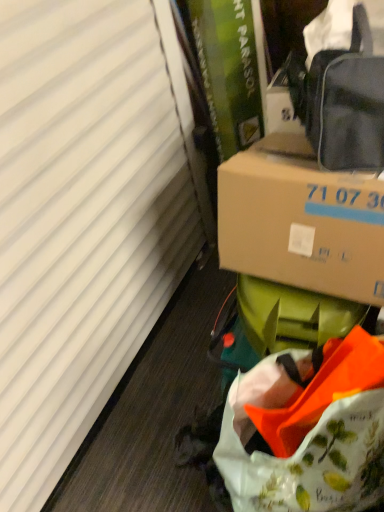
Describe the element at coordinates (342, 101) in the screenshot. Image resolution: width=384 pixels, height=512 pixels. I see `matte black bag at upper right` at that location.

The height and width of the screenshot is (512, 384). What are the coordinates of `white matte curtain at left` in the screenshot? It's located at (82, 220).

The width and height of the screenshot is (384, 512). I want to click on matte black bag at upper right, so click(342, 101).

Considering the positions of point (351, 298) and point (141, 241), is point (351, 298) closer or farther from the camera than point (141, 241)?

Point (351, 298) is closer to the camera than point (141, 241).

How different are the orientations of brown cardboard box at center-right and white matte curtain at left in degrees?

The facing directions of brown cardboard box at center-right and white matte curtain at left are 90.3 degrees apart.

Are brown cardboard box at center-right and white matte curtain at left located far from each other?

No, there isn't a large distance between brown cardboard box at center-right and white matte curtain at left.

Find the location of a particular element. Image resolution: width=384 pixels, height=512 pixels. box positioned vertically above the floral printed fabric bag at lower right (from a real-world perspective) is located at coordinates (301, 221).

In terms of height, does brown cardboard box at center-right look taller or shorter compared to floral printed fabric bag at lower right?

In the image, brown cardboard box at center-right appears to be shorter than floral printed fabric bag at lower right.

Does point (232, 252) come farther from viewer compared to point (294, 416)?

Yes, it is.

What's the angular difference between matte black bag at upper right and brown cardboard box at center-right's facing directions?

The angle between the facing direction of matte black bag at upper right and the facing direction of brown cardboard box at center-right is 5.55 degrees.

Considering the sizes of matte black bag at upper right and brown cardboard box at center-right in the image, is matte black bag at upper right bigger or smaller than brown cardboard box at center-right?

In the image, matte black bag at upper right appears to be smaller than brown cardboard box at center-right.

Choose the correct answer: Is matte black bag at upper right inside brown cardboard box at center-right or outside it?

matte black bag at upper right is not enclosed by brown cardboard box at center-right.

Which is closer, (376, 92) or (346, 291)?

Clearly, point (376, 92) is closer to the camera than point (346, 291).

Which is in front, point (370, 378) or point (314, 148)?

The point (370, 378) is closer to the camera.

Is floral printed fabric bag at lower right facing away from matte black bag at upper right?

That's not correct — floral printed fabric bag at lower right is not looking away from matte black bag at upper right.

Is the surface of floral printed fabric bag at lower right in direct contact with matte black bag at upper right?

No, floral printed fabric bag at lower right is not with matte black bag at upper right.

Which object is further away from the camera taking this photo, floral printed fabric bag at lower right or matte black bag at upper right?

matte black bag at upper right is behind.

Is point (91, 166) closer or farther from the camera than point (368, 201)?

Clearly, point (91, 166) is more distant from the camera than point (368, 201).

Is white matte curtain at left turned away from brown cardboard box at center-right?

Correct, white matte curtain at left is looking away from brown cardboard box at center-right.

How different are the orientations of white matte curtain at left and brown cardboard box at center-right in degrees?

90.3 degrees separate the facing orientations of white matte curtain at left and brown cardboard box at center-right.

Are white matte curtain at left and brown cardboard box at center-right making contact?

No.

What's the angular difference between floral printed fabric bag at lower right and white matte curtain at left's facing directions?

61.7 degrees separate the facing orientations of floral printed fabric bag at lower right and white matte curtain at left.

From the image's perspective, which object appears higher, floral printed fabric bag at lower right or white matte curtain at left?

white matte curtain at left appears higher in the image.

From a real-world perspective, is floral printed fabric bag at lower right below white matte curtain at left?

Yes, from a real-world perspective, floral printed fabric bag at lower right is under white matte curtain at left.

Is floral printed fabric bag at lower right turned away from white matte curtain at left?

No, white matte curtain at left is not at the back of floral printed fabric bag at lower right.

Between matte black bag at upper right and white matte curtain at left, which one has smaller size?

matte black bag at upper right.

From a real-world perspective, is matte black bag at upper right on white matte curtain at left?

Correct, in the physical world, matte black bag at upper right is higher than white matte curtain at left.

Where is `box lying above the white matte curtain at left (from the image's perspective)`? The width and height of the screenshot is (384, 512). box lying above the white matte curtain at left (from the image's perspective) is located at coordinates (301, 221).

Locate an element on the screen. This screenshot has width=384, height=512. bag that appears in front of the brown cardboard box at center-right is located at coordinates (308, 430).

Based on their spatial positions, is matte black bag at upper right or floral printed fabric bag at lower right further from brown cardboard box at center-right?

floral printed fabric bag at lower right lies further to brown cardboard box at center-right than the other object.

Looking at the image, which one is located further to brown cardboard box at center-right, floral printed fabric bag at lower right or white matte curtain at left?

Among the two, white matte curtain at left is located further to brown cardboard box at center-right.

When comparing their distances from matte black bag at upper right, does white matte curtain at left or floral printed fabric bag at lower right seem closer?

floral printed fabric bag at lower right is positioned closer to the anchor matte black bag at upper right.

Considering their positions, is brown cardboard box at center-right positioned further to white matte curtain at left than floral printed fabric bag at lower right?

floral printed fabric bag at lower right lies further to white matte curtain at left than the other object.

When comparing their distances from floral printed fabric bag at lower right, does matte black bag at upper right or brown cardboard box at center-right seem further?

Among the two, matte black bag at upper right is located further to floral printed fabric bag at lower right.

Looking at the image, which one is located closer to brown cardboard box at center-right, white matte curtain at left or matte black bag at upper right?

matte black bag at upper right.

From the image, which object appears to be nearer to matte black bag at upper right, brown cardboard box at center-right or white matte curtain at left?

Based on the image, brown cardboard box at center-right appears to be nearer to matte black bag at upper right.

Based on their spatial positions, is floral printed fabric bag at lower right or white matte curtain at left closer to matte black bag at upper right?

floral printed fabric bag at lower right.

The image size is (384, 512). Find the location of `box between white matte curtain at left and matte black bag at upper right from left to right`. box between white matte curtain at left and matte black bag at upper right from left to right is located at coordinates pos(301,221).

I want to click on curtain between matte black bag at upper right and floral printed fabric bag at lower right from top to bottom, so click(x=82, y=220).

At what (x,y) coordinates should I click in order to perform the action: click on box between matte black bag at upper right and floral printed fabric bag at lower right in the up-down direction. Please return your answer as a coordinate pair (x, y). Looking at the image, I should click on (301, 221).

At what (x,y) coordinates should I click in order to perform the action: click on bag situated between white matte curtain at left and brown cardboard box at center-right from left to right. Please return your answer as a coordinate pair (x, y). Looking at the image, I should click on (308, 430).